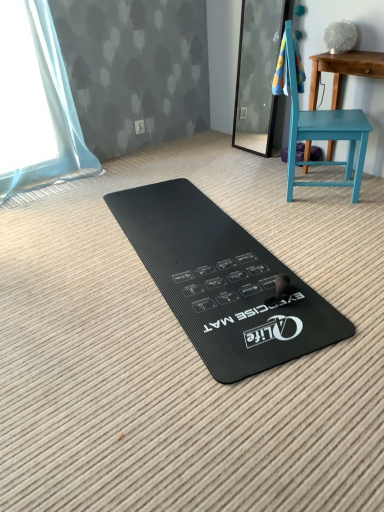
Question: In terms of width, does blue textured towel at upper right look wider or thinner when compared to black rubber exercise mat at center?

Choices:
 (A) wide
 (B) thin

Answer: (B)

Question: Based on their positions, is blue textured towel at upper right located to the left or right of black rubber exercise mat at center?

Choices:
 (A) right
 (B) left

Answer: (A)

Question: Which of these objects is positioned farthest from the blue textured towel at upper right?

Choices:
 (A) teal painted wood table at right
 (B) teal matte chair at right
 (C) black rubber exercise mat at center

Answer: (C)

Question: Estimate the real-world distances between objects in this image. Which object is farther from the blue textured towel at upper right?

Choices:
 (A) teal painted wood table at right
 (B) teal matte chair at right
 (C) black rubber exercise mat at center

Answer: (C)